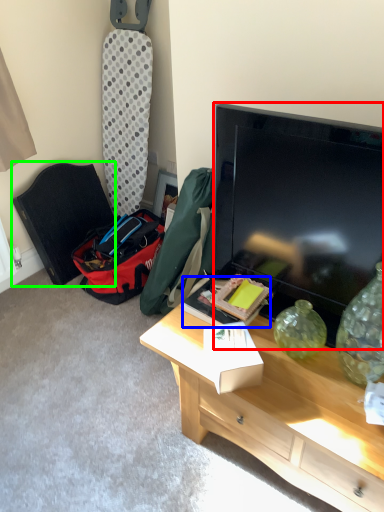
Question: Considering the real-world distances, which object is closest to television (highlighted by a red box)? box (highlighted by a blue box) or folding chair (highlighted by a green box).

Choices:
 (A) box
 (B) folding chair

Answer: (A)